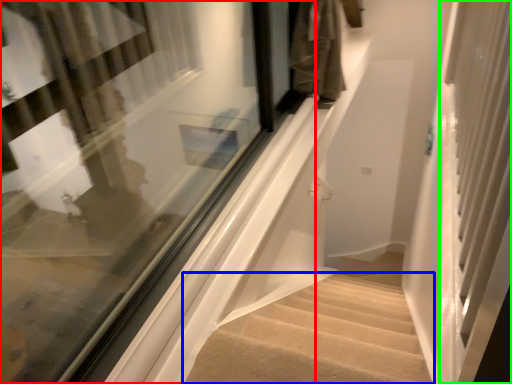
Question: Which object is the closest to the window (highlighted by a red box)? Choose among these: stairs (highlighted by a blue box) or screen door (highlighted by a green box).

Choices:
 (A) stairs
 (B) screen door

Answer: (A)